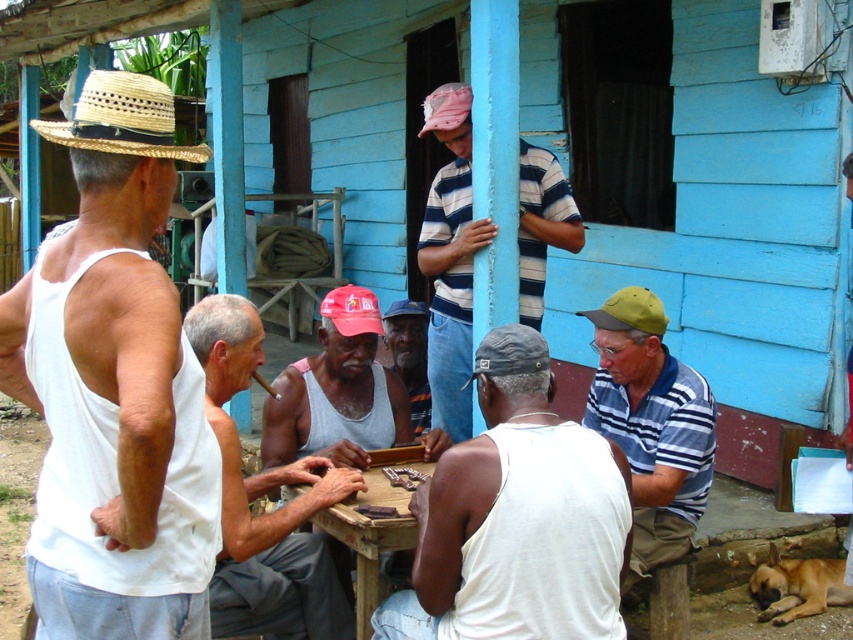
You are standing at point (426, 310) and want to walk to the rustic blue house. There is a path that goes through point (297, 538). Is the path between these two points clear of any obstacles?

Point (297, 538) is in front of point (426, 310). Since the path goes through point (297, 538) which is in front, there are no obstacles blocking the path between them.